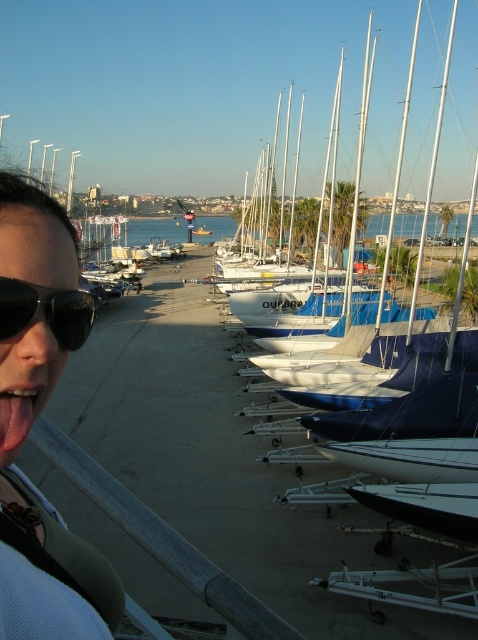
You are standing at point (25,301) and want to walk to point (452,497). Given the marina layout described, will you be able to see the person with the sunglasses throughout your journey?

Since point (452,497) is behind point (25,301), you will not be able to see the person with the sunglasses throughout your journey as you move towards the destination point.

You are a photographer trying to capture a shot of the white matte sailboat at center without the pink glossy tongue at lower left appearing in the frame. Based on their positions, is this possible?

The pink glossy tongue at lower left is below the white matte sailboat at center, so adjusting the camera angle upward might allow you to frame the sailboat without including the tongue in the shot.